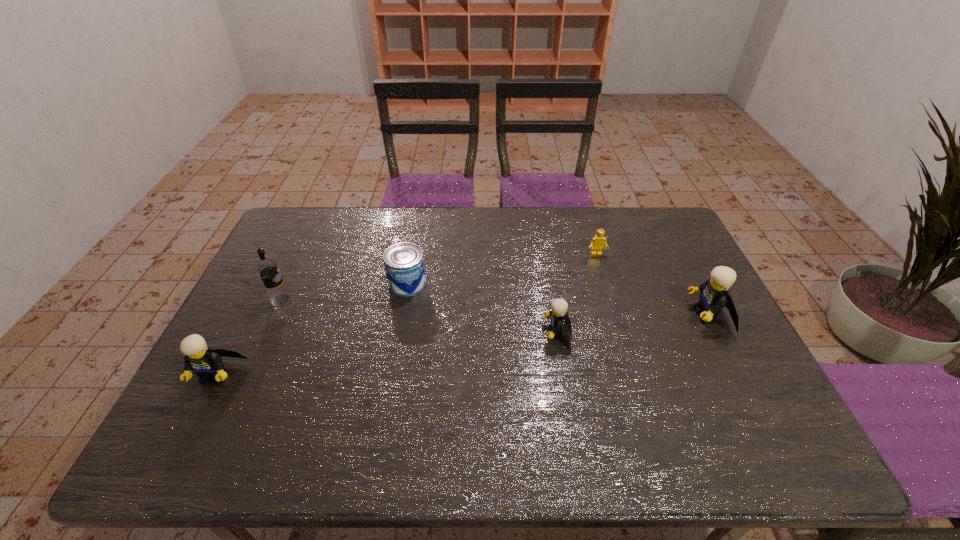
You are a GUI agent. You are given a task and a screenshot of the screen. Output one action in this format:
    pyautogui.click(x=<x>, y=<y>)
    Task: Click on the leftmost Lego
    
    Given the screenshot: What is the action you would take?
    pos(206,362)

In order to click on the third tallest object in this screenshot , I will do `click(206, 362)`.

This screenshot has width=960, height=540. What are the coordinates of `the second Lego from left to right` in the screenshot? It's located at (559, 307).

Find the location of a particular element. the second shortest Lego is located at coordinates (559, 307).

Where is `the rightmost object`? This screenshot has height=540, width=960. the rightmost object is located at coordinates (714, 296).

At what (x,y) coordinates should I click in order to perform the action: click on the shortest Lego. Please return your answer as a coordinate pair (x, y). Image resolution: width=960 pixels, height=540 pixels. Looking at the image, I should click on (597, 243).

Where is `the third Lego from left to right`? The width and height of the screenshot is (960, 540). the third Lego from left to right is located at coordinates (597, 243).

The width and height of the screenshot is (960, 540). Find the location of `vodka`. vodka is located at coordinates (268, 269).

Identify the location of can. (404, 263).

The width and height of the screenshot is (960, 540). Identify the location of vacant space situated on the front-facing side of the third tallest Lego. (404, 333).